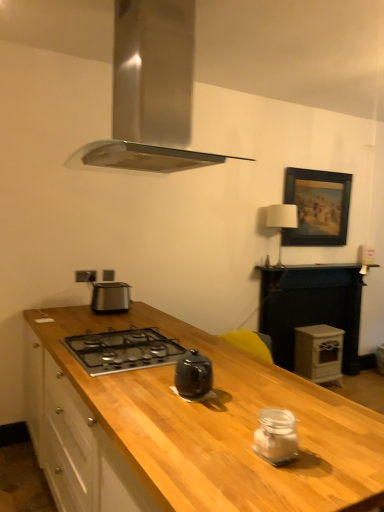
Identify the location of free spot above wooden at center (from a real-world perspective). (172, 373).